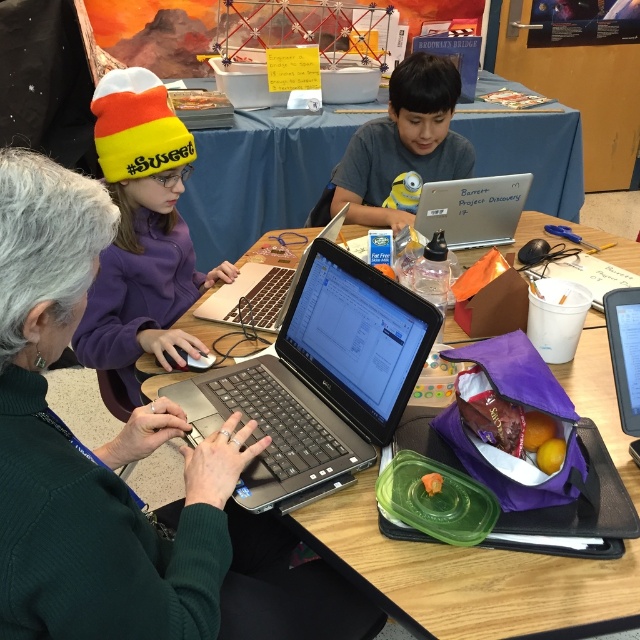
Question: Is gray cotton shirt at center positioned behind silver/black laptop at center?

Choices:
 (A) no
 (B) yes

Answer: (B)

Question: Can you confirm if wooden table at center is positioned to the right of silver metallic laptop at center?

Choices:
 (A) yes
 (B) no

Answer: (B)

Question: Based on their relative distances, which object is nearer to the green ribbed sweater at center?

Choices:
 (A) black matte laptop at center
 (B) silver metallic laptop at center
 (C) black glossy tablet at right
 (D) silver/black laptop at center

Answer: (A)

Question: Estimate the real-world distances between objects in this image. Which object is closer to the gray cotton shirt at center?

Choices:
 (A) wooden table at center
 (B) black matte laptop at center
 (C) orange knit beanie at upper left
 (D) green ribbed sweater at center

Answer: (A)

Question: Among these objects, which one is nearest to the camera?

Choices:
 (A) black matte laptop at center
 (B) gray cotton shirt at center
 (C) black glossy tablet at right

Answer: (A)

Question: Does black plastic laptop at center have a larger size compared to silver metallic laptop at center?

Choices:
 (A) yes
 (B) no

Answer: (A)